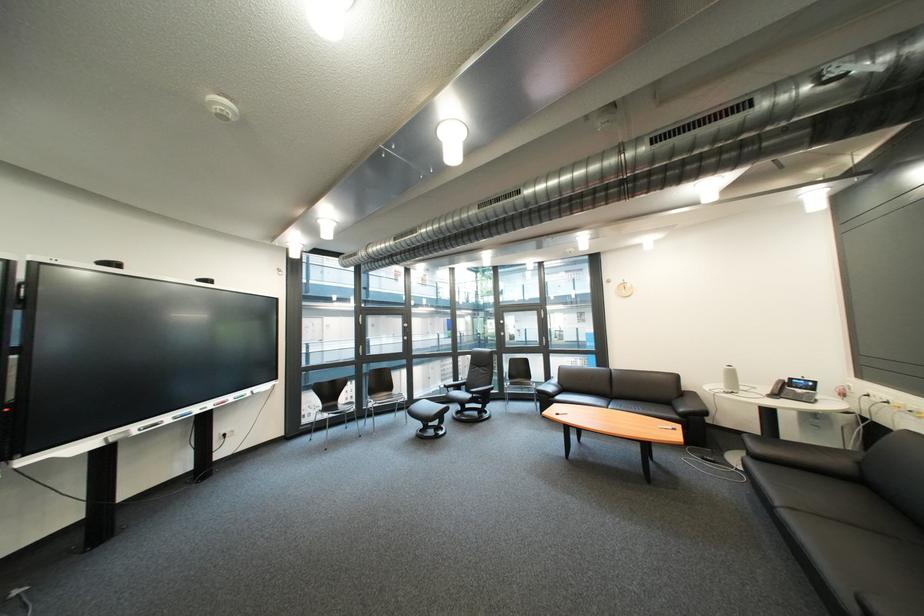
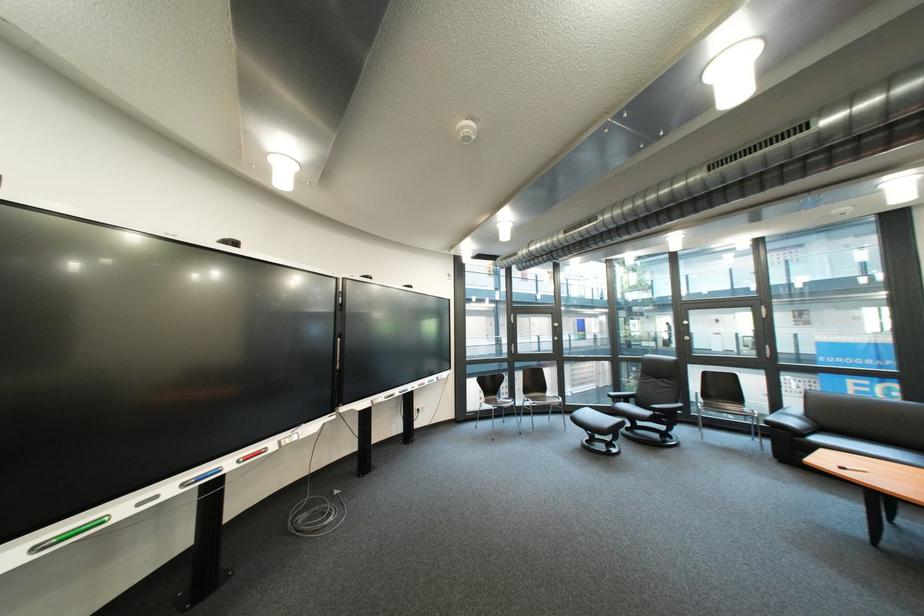
In the second image, find the point that corresponds to point (433, 432) in the first image.

(601, 443)